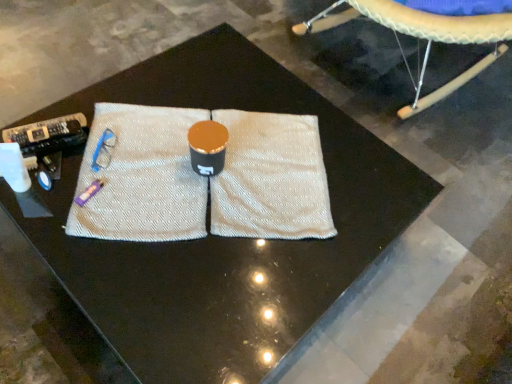
Question: From a real-world perspective, is beige leather cushion at upper right physically above white textured yoga mat at center?

Choices:
 (A) no
 (B) yes

Answer: (B)

Question: Considering the relative sizes of beige leather cushion at upper right and white textured yoga mat at center in the image provided, is beige leather cushion at upper right bigger than white textured yoga mat at center?

Choices:
 (A) no
 (B) yes

Answer: (B)

Question: Is the position of beige leather cushion at upper right more distant than that of white textured yoga mat at center?

Choices:
 (A) no
 (B) yes

Answer: (B)

Question: Are beige leather cushion at upper right and white textured yoga mat at center far apart?

Choices:
 (A) no
 (B) yes

Answer: (A)

Question: Is white textured yoga mat at center at the back of beige leather cushion at upper right?

Choices:
 (A) yes
 (B) no

Answer: (B)

Question: Are beige leather cushion at upper right and white textured yoga mat at center beside each other?

Choices:
 (A) yes
 (B) no

Answer: (B)

Question: Does white textured yoga mat at center have a larger size compared to beige leather cushion at upper right?

Choices:
 (A) no
 (B) yes

Answer: (A)

Question: Is white textured yoga mat at center smaller than beige leather cushion at upper right?

Choices:
 (A) yes
 (B) no

Answer: (A)

Question: From a real-world perspective, is white textured yoga mat at center on beige leather cushion at upper right?

Choices:
 (A) yes
 (B) no

Answer: (B)

Question: Does white textured yoga mat at center appear on the right side of beige leather cushion at upper right?

Choices:
 (A) yes
 (B) no

Answer: (B)

Question: Can you confirm if white textured yoga mat at center is positioned to the left of beige leather cushion at upper right?

Choices:
 (A) no
 (B) yes

Answer: (B)

Question: From the image's perspective, is white textured yoga mat at center on top of beige leather cushion at upper right?

Choices:
 (A) no
 (B) yes

Answer: (A)

Question: Considering their positions, is beige leather cushion at upper right located in front of or behind white textured yoga mat at center?

Choices:
 (A) front
 (B) behind

Answer: (B)